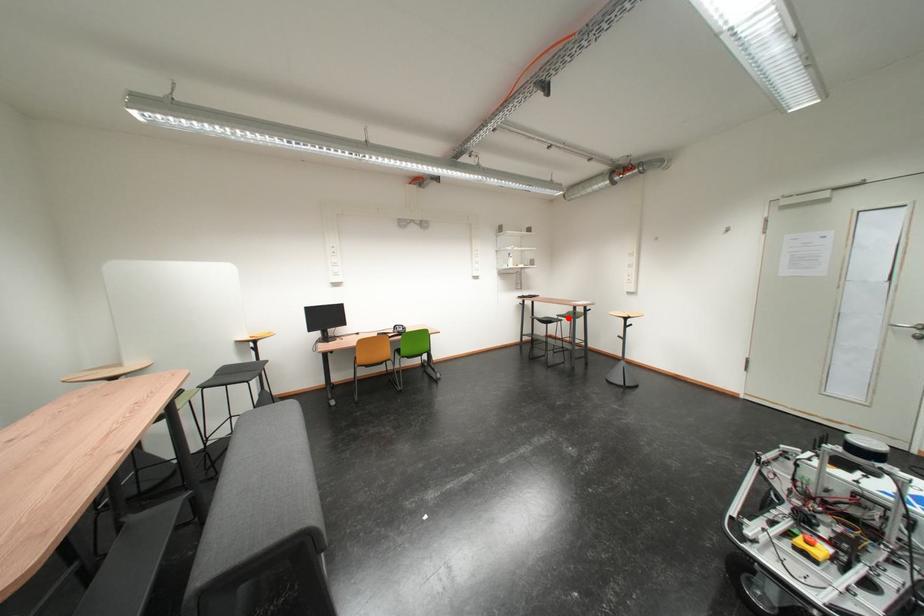
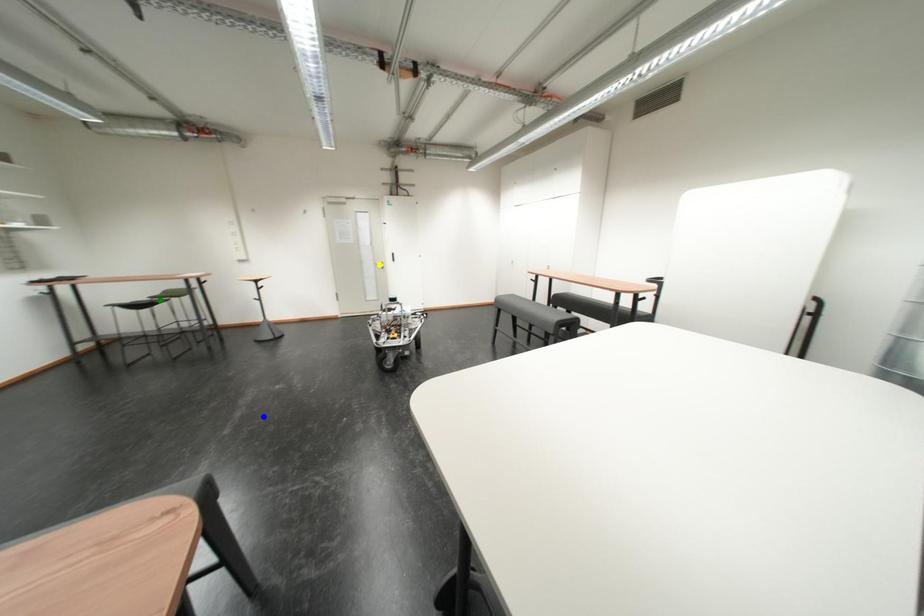
Question: I am providing you with two images of the same scene from different viewpoints. A red point is marked on the first image. You are given multiple points on the second image. Which mark in image 2 goes with the point in image 1?

Choices:
 (A) green point
 (B) yellow point
 (C) blue point

Answer: (A)